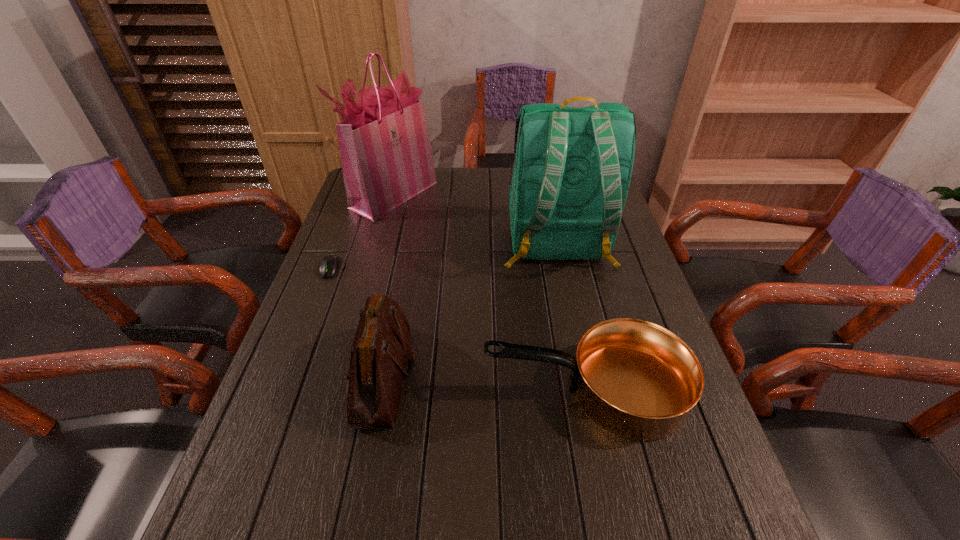
Find the location of `free spot at the left edge of the desktop`. free spot at the left edge of the desktop is located at coordinates (285, 451).

The height and width of the screenshot is (540, 960). Identify the location of vacant space at the right edge of the desktop. (642, 294).

At what (x,y) coordinates should I click in order to perform the action: click on free spot between the fourth tallest object and the backpack. Please return your answer as a coordinate pair (x, y). The height and width of the screenshot is (540, 960). Looking at the image, I should click on (571, 317).

At what (x,y) coordinates should I click in order to perform the action: click on vacant point located between the third tallest object and the shopping bag. Please return your answer as a coordinate pair (x, y). This screenshot has width=960, height=540. Looking at the image, I should click on (389, 285).

Where is `free area in between the shopping bag and the backpack`? free area in between the shopping bag and the backpack is located at coordinates (475, 219).

Locate an element on the screen. vacant area between the backpack and the shortest object is located at coordinates (444, 256).

Identify the location of empty space between the backpack and the shoulder bag. The image size is (960, 540). (470, 310).

Find the location of `vacant space that is in between the shopping bag and the backpack`. vacant space that is in between the shopping bag and the backpack is located at coordinates (475, 219).

This screenshot has width=960, height=540. I want to click on empty space that is in between the shopping bag and the shortest object, so click(x=362, y=231).

The width and height of the screenshot is (960, 540). Find the location of `free space between the backpack and the computer mouse`. free space between the backpack and the computer mouse is located at coordinates click(x=444, y=256).